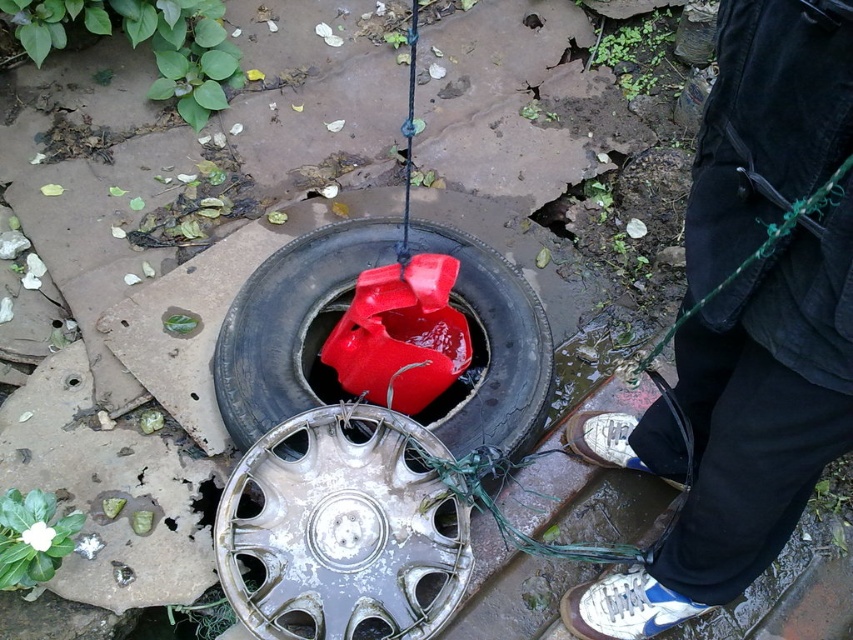
Question: Considering the real-world distances, which object is closest to the glossy rubber tire at center?

Choices:
 (A) silver metallic hubcap at center
 (B) dark blue jeans at lower right

Answer: (A)

Question: Considering the relative positions of dark blue jeans at lower right and glossy rubber tire at center in the image provided, where is dark blue jeans at lower right located with respect to glossy rubber tire at center?

Choices:
 (A) below
 (B) above

Answer: (B)

Question: Is dark blue jeans at lower right bigger than glossy rubber tire at center?

Choices:
 (A) yes
 (B) no

Answer: (A)

Question: Which object appears closest to the camera in this image?

Choices:
 (A) glossy rubber tire at center
 (B) dark blue jeans at lower right
 (C) silver metallic hubcap at center

Answer: (B)

Question: Is dark blue jeans at lower right below silver metallic hubcap at center?

Choices:
 (A) yes
 (B) no

Answer: (B)

Question: Among these objects, which one is nearest to the camera?

Choices:
 (A) glossy rubber tire at center
 (B) dark blue jeans at lower right

Answer: (B)